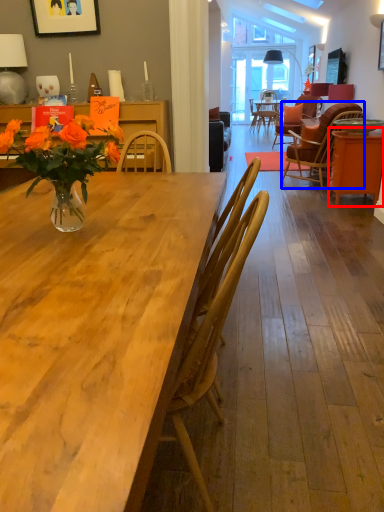
Question: Which object is closer to the camera taking this photo, table (highlighted by a red box) or chair (highlighted by a blue box)?

Choices:
 (A) table
 (B) chair

Answer: (A)